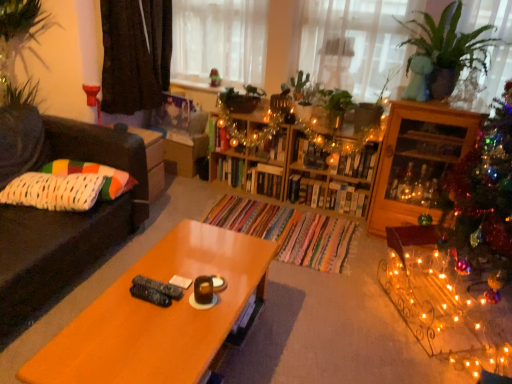
Identify the location of blank area to the left of wooden bookshelf at center, which is the 2th shelf from left to right. (268, 208).